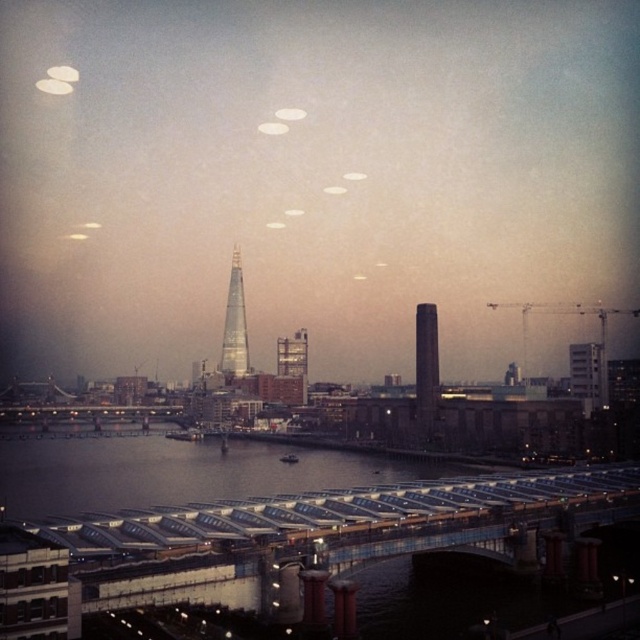
You are a photographer planning to capture the skyline of the city. You notice the shiny glass skyscraper at center and the white concrete tower at right. Based on their positions, which one would appear taller in your photo?

The shiny glass skyscraper at center appears taller than the white concrete tower at right in the photo because it is positioned above it in the scene.

You are an architect evaluating the city skyline. You notice the smooth glass tower at center and the shiny glass skyscraper at center. Which of these two structures is taller?

The shiny glass skyscraper at center is taller than the smooth glass tower at center.

You are a drone operator who needs to fly a drone between the smooth glass tower at center and the shiny glass skyscraper at center. The drone has a maximum flight distance of 150 meters. Can the drone safely fly between them without exceeding its range?

The smooth glass tower at center is 145.21 meters away from the shiny glass skyscraper at center. Since the drone has a maximum flight distance of 150 meters, it can safely fly between them as the distance is within the drone operator limits.